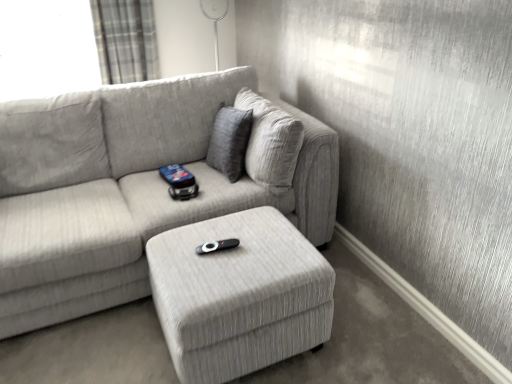
This screenshot has width=512, height=384. I want to click on free space behind black plastic remote at center, so click(x=226, y=226).